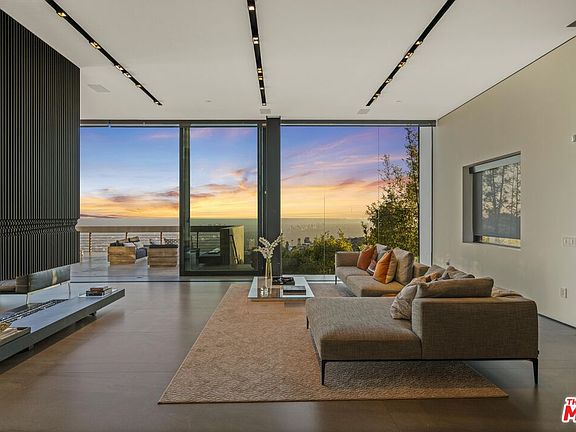
Identify the location of table. The height and width of the screenshot is (432, 576). (300, 279).